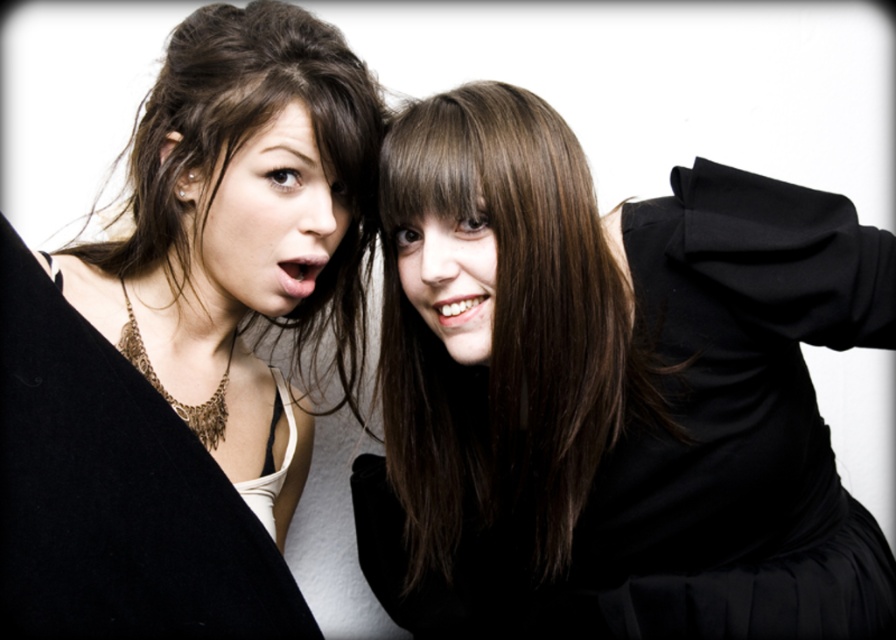
Does matte black coat at left have a greater width compared to smooth skin face at center?

Yes, matte black coat at left is wider than smooth skin face at center.

Is point (248, 472) positioned behind point (421, 262)?

Yes.

Locate an element on the screen. This screenshot has width=896, height=640. matte black coat at left is located at coordinates (186, 342).

Based on the photo, can you confirm if matte black coat at left is thinner than matte black face at upper left?

Incorrect, matte black coat at left's width is not less than matte black face at upper left's.

Which is below, matte black coat at left or matte black face at upper left?

matte black coat at left is lower down.

Who is more distant from viewer, (204, 497) or (210, 275)?

Positioned behind is point (210, 275).

The width and height of the screenshot is (896, 640). Identify the location of matte black coat at left. 186,342.

Can you confirm if black matte dress at center is positioned to the left of matte black face at upper left?

In fact, black matte dress at center is to the right of matte black face at upper left.

The image size is (896, 640). In order to click on black matte dress at center in this screenshot , I will do `click(610, 394)`.